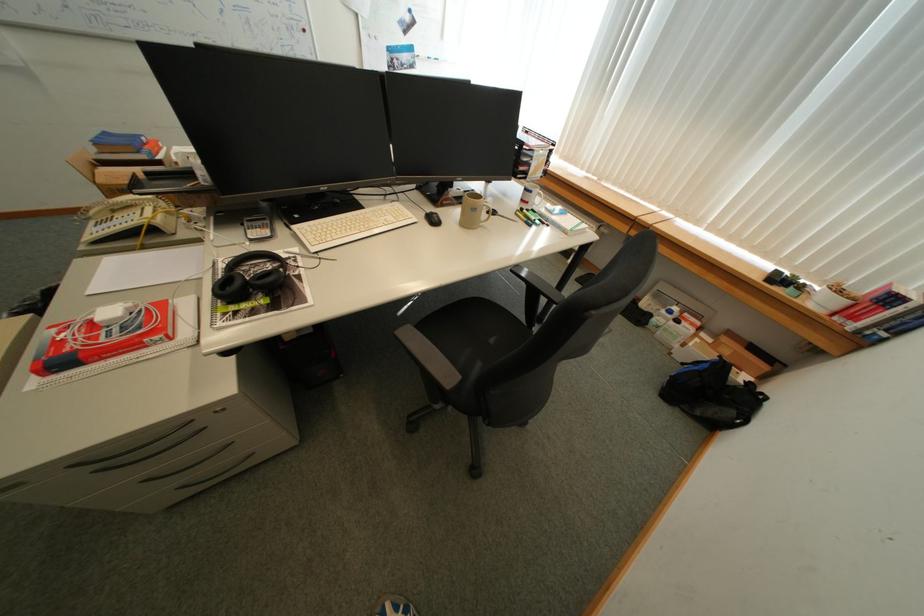
Where is `chair armrest`? This screenshot has width=924, height=616. chair armrest is located at coordinates (428, 357).